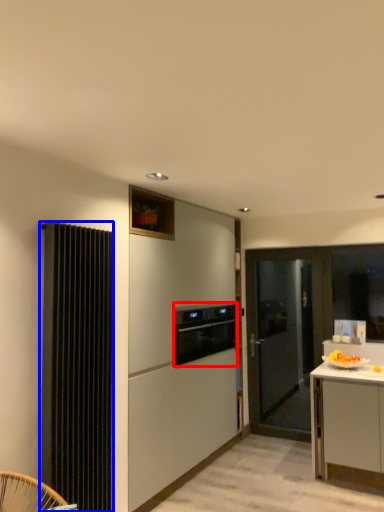
Question: Which point is closer to the camera, kitchen appliance (highlighted by a red box) or radiator (highlighted by a blue box)?

Choices:
 (A) kitchen appliance
 (B) radiator

Answer: (B)